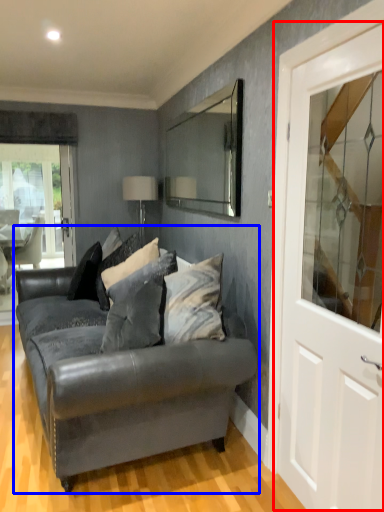
Question: Among these objects, which one is farthest to the camera, door (highlighted by a red box) or studio couch (highlighted by a blue box)?

Choices:
 (A) door
 (B) studio couch

Answer: (B)